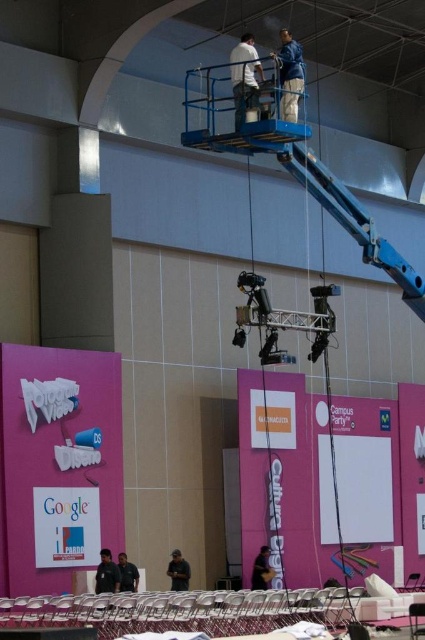
You are standing in the conference hall and see two points marked in the image. Which point is closer to you, point (99, 552) or point (181, 586)?

Point (99, 552) is closer to the viewer than point (181, 586).

You are organizing a safety briefing for workers in the conference hall. You need to ensure that all workers are within a 3 meter radius of each other for clear communication. Are the dark gray fabric jacket at lower center and dark gray shirt at lower center within the required distance?

The distance between the dark gray fabric jacket at lower center and the dark gray shirt at lower center is 3.67 meters, which exceeds the 3 meter radius requirement. Therefore, they are not within the required distance for clear communication.